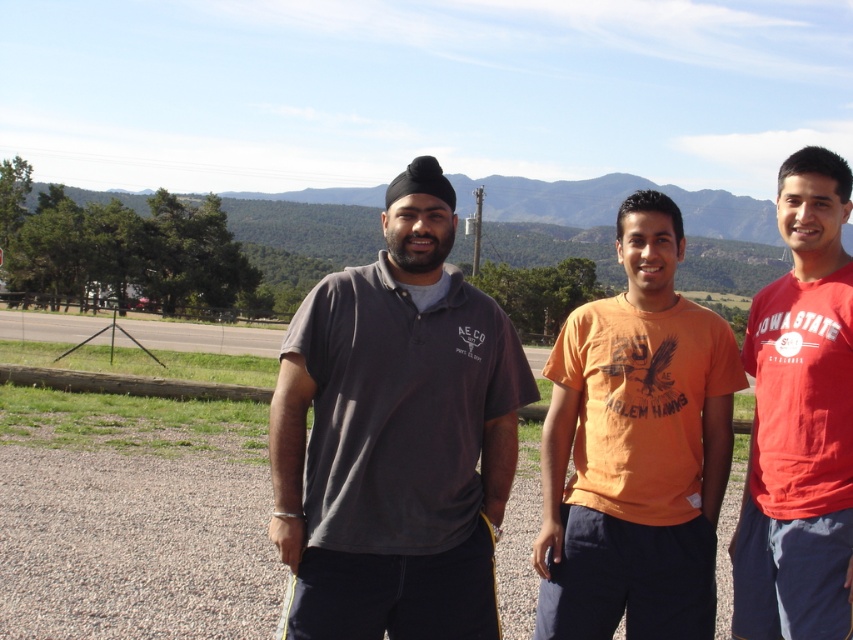
Does dark gray polo shirt at center appear on the left side of orange cotton t-shirt at center?

Indeed, dark gray polo shirt at center is positioned on the left side of orange cotton t-shirt at center.

In order to click on dark gray polo shirt at center in this screenshot , I will do `click(395, 436)`.

Where is `dark gray polo shirt at center`? Image resolution: width=853 pixels, height=640 pixels. dark gray polo shirt at center is located at coordinates (395, 436).

Which is below, dark gray polo shirt at center or matte red t-shirt at right?

matte red t-shirt at right is below.

Is point (511, 362) positioned in front of point (804, 180)?

That is False.

This screenshot has height=640, width=853. I want to click on dark gray polo shirt at center, so click(395, 436).

Is point (598, 448) behind point (788, 195)?

Yes, it is.

Who is lower down, orange cotton t-shirt at center or matte red t-shirt at right?

→ matte red t-shirt at right is lower down.

Does point (672, 241) come in front of point (747, 512)?

No, (672, 241) is behind (747, 512).

At what (x,y) coordinates should I click in order to perform the action: click on orange cotton t-shirt at center. Please return your answer as a coordinate pair (x, y). Looking at the image, I should click on (635, 449).